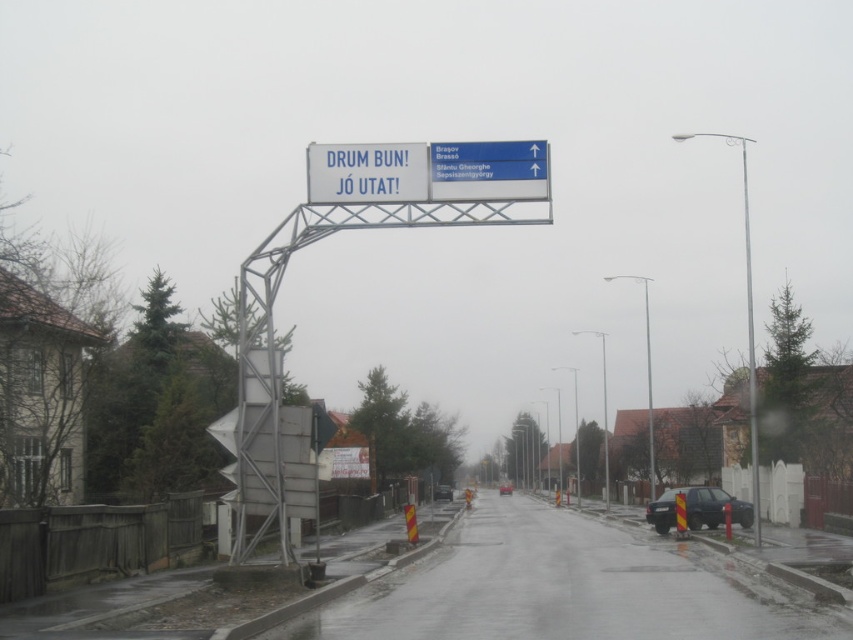
Question: Considering the real-world distances, which object is farthest from the blue plastic sign at upper center?

Choices:
 (A) metallic pole at right
 (B) white plastic sign at upper center

Answer: (A)

Question: Is white plastic sign at upper center to the right of blue plastic sign at upper center from the viewer's perspective?

Choices:
 (A) yes
 (B) no

Answer: (B)

Question: Estimate the real-world distances between objects in this image. Which object is farther from the blue plastic sign at upper center?

Choices:
 (A) white plastic sign at upper center
 (B) metallic pole at right

Answer: (B)

Question: Can you confirm if white plastic sign at upper center is positioned to the right of metallic pole at right?

Choices:
 (A) no
 (B) yes

Answer: (A)

Question: Which of the following is the closest to the observer?

Choices:
 (A) (419, 189)
 (B) (753, 372)

Answer: (A)

Question: Is white plastic sign at upper center closer to camera compared to metallic pole at right?

Choices:
 (A) no
 (B) yes

Answer: (B)